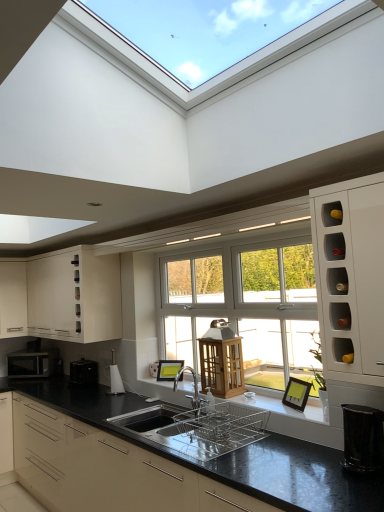
In order to face matte white cabinet at upper left, positioned as the second cabinetry in top-to-bottom order, should I rotate leftwards or rightwards?

Rotate left and turn 16.538 degrees.

What do you see at coordinates (84, 372) in the screenshot? This screenshot has height=512, width=384. I see `black plastic toaster at lower left, acting as the fourth appliance starting from the right` at bounding box center [84, 372].

What do you see at coordinates (212, 430) in the screenshot?
I see `polished stainless steel dish rack at center, placed as the second appliance when sorted from right to left` at bounding box center [212, 430].

Where is `black glossy trash can at lower right, arranged as the first appliance when viewed from the front`? black glossy trash can at lower right, arranged as the first appliance when viewed from the front is located at coordinates (363, 438).

You are a GUI agent. You are given a task and a screenshot of the screen. Output one action in this format:
    pyautogui.click(x=<x>, y=<y>)
    Task: Click on the white matte cabinet at left, which is counted as the second cabinetry, starting from the bottom
    
    Given the screenshot: What is the action you would take?
    pyautogui.click(x=13, y=298)

From the image's perspective, is silver metallic microwave at left located above or below black plastic toaster at lower left, acting as the fourth appliance starting from the right?

silver metallic microwave at left is situated lower than black plastic toaster at lower left, acting as the fourth appliance starting from the right, in the image.

Find the location of a particular element. home appliance below the black plastic toaster at lower left, which is the fourth appliance in front-to-back order (from the image's perspective) is located at coordinates click(32, 362).

How far apart are silver metallic microwave at left and black plastic toaster at lower left, which is the fourth appliance in front-to-back order?

silver metallic microwave at left and black plastic toaster at lower left, which is the fourth appliance in front-to-back order, are 22.48 inches apart from each other.

The height and width of the screenshot is (512, 384). In order to click on cabinetry that appears on the left of matte white cabinet at upper left, positioned as the second cabinetry in top-to-bottom order in this screenshot , I will do `click(13, 298)`.

What's the angular difference between white matte cabinet at left, which is the third cabinetry in top-to-bottom order, and matte white cabinet at upper left, positioned as the second cabinetry in top-to-bottom order,'s facing directions?

The angular difference between white matte cabinet at left, which is the third cabinetry in top-to-bottom order, and matte white cabinet at upper left, positioned as the second cabinetry in top-to-bottom order, is 89.8 degrees.

Between point (10, 291) and point (38, 273), which one is positioned in front?

The point (38, 273) is closer.

Is white matte cabinet at left, which is counted as the second cabinetry, starting from the bottom, to the right of matte white cabinet at upper left, positioned as the 3th cabinetry in bottom-to-top order, from the viewer's perspective?

No.

Is white matte cabinet at left, which is the third cabinetry in top-to-bottom order, turned away from black plastic toaster at lower left, positioned as the first appliance in back-to-front order?

No, white matte cabinet at left, which is the third cabinetry in top-to-bottom order,'s orientation is not away from black plastic toaster at lower left, positioned as the first appliance in back-to-front order.

Which cabinetry is the 2nd one when counting from the left side of the black plastic toaster at lower left, positioned as the first appliance in back-to-front order? Please provide its 2D coordinates.

[(13, 298)]

How much distance is there between white matte cabinet at left, which is counted as the second cabinetry, starting from the bottom, and black plastic toaster at lower left, acting as the fourth appliance starting from the right?

white matte cabinet at left, which is counted as the second cabinetry, starting from the bottom, is 37.86 inches from black plastic toaster at lower left, acting as the fourth appliance starting from the right.

Which is more to the right, white matte cabinet at left, which is the third cabinetry in top-to-bottom order, or black plastic toaster at lower left, which is counted as the 1th appliance, starting from the left?

Positioned to the right is black plastic toaster at lower left, which is counted as the 1th appliance, starting from the left.

How different are the orientations of black plastic toaster at lower left, which is counted as the 1th appliance, starting from the left, and matte white cabinet at upper left, positioned as the 3th cabinetry in bottom-to-top order, in degrees?

The angular difference between black plastic toaster at lower left, which is counted as the 1th appliance, starting from the left, and matte white cabinet at upper left, positioned as the 3th cabinetry in bottom-to-top order, is 0.666 degrees.

Looking at this image, which is more to the right, black plastic toaster at lower left, acting as the fourth appliance starting from the right, or matte white cabinet at upper left, positioned as the 3th cabinetry in bottom-to-top order?

From the viewer's perspective, black plastic toaster at lower left, acting as the fourth appliance starting from the right, appears more on the right side.

From the image's perspective, is black plastic toaster at lower left, positioned as the first appliance in back-to-front order, below matte white cabinet at upper left, positioned as the 3th cabinetry in bottom-to-top order?

Yes, from the image's perspective, black plastic toaster at lower left, positioned as the first appliance in back-to-front order, is beneath matte white cabinet at upper left, positioned as the 3th cabinetry in bottom-to-top order.

From the picture: Which of these two, black plastic toaster at lower left, which is the fourth appliance in front-to-back order, or matte white cabinet at upper left, positioned as the 3th cabinetry in bottom-to-top order, stands shorter?

Standing shorter between the two is black plastic toaster at lower left, which is the fourth appliance in front-to-back order.

Between black glossy trash can at lower right, placed as the first appliance when sorted from right to left, and polished stainless steel dish rack at center, which is counted as the 3th appliance, starting from the back, which one has smaller width?

black glossy trash can at lower right, placed as the first appliance when sorted from right to left, is thinner.

Visually, is black glossy trash can at lower right, arranged as the first appliance when viewed from the front, positioned to the left or to the right of polished stainless steel dish rack at center, the second appliance positioned from the front?

black glossy trash can at lower right, arranged as the first appliance when viewed from the front, is to the right of polished stainless steel dish rack at center, the second appliance positioned from the front.

Could you tell me if black glossy trash can at lower right, which is the 4th appliance from back to front, is facing polished stainless steel dish rack at center, placed as the second appliance when sorted from right to left?

No, black glossy trash can at lower right, which is the 4th appliance from back to front, is not aimed at polished stainless steel dish rack at center, placed as the second appliance when sorted from right to left.

Is point (110, 454) in front of point (121, 384)?

Yes, it is in front of point (121, 384).

Would you say matte black kettle at lower center, which ranks as the second appliance in back-to-front order, is part of black matte countertop at center, arranged as the 1th cabinetry when ordered from the bottom,'s contents?

No, matte black kettle at lower center, which ranks as the second appliance in back-to-front order, is not inside black matte countertop at center, arranged as the 1th cabinetry when ordered from the bottom.

Which is more to the right, black matte countertop at center, which is the fourth cabinetry in top-to-bottom order, or matte black kettle at lower center, which is the third appliance from front to back?

From the viewer's perspective, black matte countertop at center, which is the fourth cabinetry in top-to-bottom order, appears more on the right side.

From a real-world perspective, is black matte countertop at center, which is the fourth cabinetry in top-to-bottom order, physically located above or below matte black kettle at lower center, which ranks as the second appliance in back-to-front order?

black matte countertop at center, which is the fourth cabinetry in top-to-bottom order, is situated lower than matte black kettle at lower center, which ranks as the second appliance in back-to-front order, in the real world.

In order to click on home appliance that appears behind the white glossy wine rack at right, the 4th cabinetry when ordered from bottom to top in this screenshot , I will do `click(32, 362)`.

From a real-world perspective, is white glossy wine rack at right, the first cabinetry viewed from the top, positioned above or below silver metallic microwave at left?

Clearly, from a real-world perspective, white glossy wine rack at right, the first cabinetry viewed from the top, is above silver metallic microwave at left.

From the image's perspective, which is above, white glossy wine rack at right, the 4th cabinetry when ordered from bottom to top, or silver metallic microwave at left?

From the image's view, white glossy wine rack at right, the 4th cabinetry when ordered from bottom to top, is above.

Starting from the silver metallic microwave at left, which appliance is the 1st one to the right? Please provide its 2D coordinates.

[(84, 372)]

Which cabinetry is the 1st one when counting from the front of the white matte cabinet at left, which is the third cabinetry in top-to-bottom order? Please provide its 2D coordinates.

[(62, 296)]

Considering their positions, is white matte cabinet at left, which is the third cabinetry in top-to-bottom order, positioned closer to black glossy trash can at lower right, the fourth appliance in the left-to-right sequence, than polished stainless steel dish rack at center, the second appliance positioned from the front?

polished stainless steel dish rack at center, the second appliance positioned from the front.

Estimate the real-world distances between objects in this image. Which object is further from silver metallic tap at center, polished stainless steel dish rack at center, marked as the third appliance in a left-to-right arrangement, or black matte countertop at center, which is the fourth cabinetry in top-to-bottom order?

→ black matte countertop at center, which is the fourth cabinetry in top-to-bottom order.

From the image, which object appears to be farther from silver metallic microwave at left, matte white cabinet at upper left, positioned as the second cabinetry in top-to-bottom order, or polished stainless steel dish rack at center, placed as the second appliance when sorted from right to left?

Among the two, polished stainless steel dish rack at center, placed as the second appliance when sorted from right to left, is located further to silver metallic microwave at left.

Based on the photo, looking at the image, which one is located further to white matte cabinet at left, which is the third cabinetry in top-to-bottom order, black glossy trash can at lower right, which is the 4th appliance from back to front, or black plastic toaster at lower left, acting as the fourth appliance starting from the right?

black glossy trash can at lower right, which is the 4th appliance from back to front, is further to white matte cabinet at left, which is the third cabinetry in top-to-bottom order.

Based on their spatial positions, is silver metallic microwave at left or black matte countertop at center, which is the fourth cabinetry in top-to-bottom order, further from matte black kettle at lower center, which ranks as the second appliance in back-to-front order?

silver metallic microwave at left is positioned further to the anchor matte black kettle at lower center, which ranks as the second appliance in back-to-front order.

From the image, which object appears to be farther from matte black kettle at lower center, which is the third appliance from right to left, white glossy wine rack at right, the 4th cabinetry when ordered from bottom to top, or matte white cabinet at upper left, positioned as the second cabinetry in top-to-bottom order?

The object further to matte black kettle at lower center, which is the third appliance from right to left, is white glossy wine rack at right, the 4th cabinetry when ordered from bottom to top.

From the picture: Looking at the image, which one is located further to white glossy wine rack at right, the 4th cabinetry when ordered from bottom to top, silver metallic microwave at left or matte black kettle at lower center, which is the third appliance from front to back?

silver metallic microwave at left is positioned further to the anchor white glossy wine rack at right, the 4th cabinetry when ordered from bottom to top.

Based on their spatial positions, is matte white cabinet at upper left, positioned as the second cabinetry in top-to-bottom order, or polished stainless steel dish rack at center, marked as the third appliance in a left-to-right arrangement, further from black glossy trash can at lower right, arranged as the first appliance when viewed from the front?

matte white cabinet at upper left, positioned as the second cabinetry in top-to-bottom order, lies further to black glossy trash can at lower right, arranged as the first appliance when viewed from the front, than the other object.

You are a GUI agent. You are given a task and a screenshot of the screen. Output one action in this format:
    pyautogui.click(x=<x>, y=<y>)
    Task: Click on the cabinetry between silver metallic microwave at left and matte black kettle at lower center, which is the third appliance from front to back
    The image size is (384, 512).
    Given the screenshot: What is the action you would take?
    pyautogui.click(x=62, y=296)

Identify the location of tap located between white glossy wine rack at right, the 4th cabinetry when ordered from bottom to top, and silver metallic microwave at left in the depth direction. tap(194, 392).

Where is `cabinetry between white matte cabinet at left, which is counted as the second cabinetry, starting from the bottom, and black plastic toaster at lower left, acting as the fourth appliance starting from the right`? The width and height of the screenshot is (384, 512). cabinetry between white matte cabinet at left, which is counted as the second cabinetry, starting from the bottom, and black plastic toaster at lower left, acting as the fourth appliance starting from the right is located at coordinates (62, 296).

The image size is (384, 512). I want to click on appliance between polished stainless steel dish rack at center, which is counted as the 3th appliance, starting from the back, and matte white cabinet at upper left, positioned as the second cabinetry in top-to-bottom order, in the front-back direction, so click(115, 378).